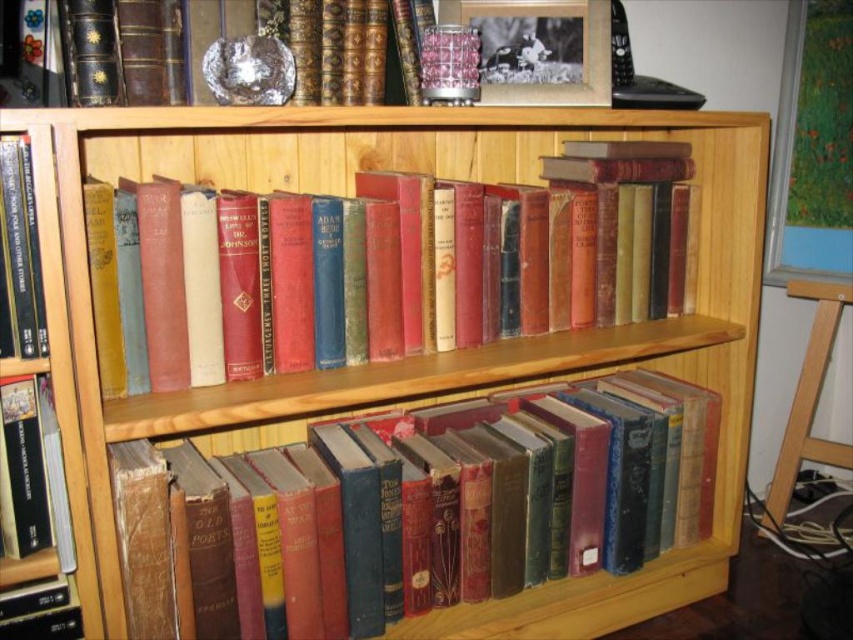
Measure the distance between point (660, 310) and camera.

A distance of 1.33 meters exists between point (660, 310) and camera.

Who is more distant from viewer, [538,269] or [12,225]?

Point [538,269]

This screenshot has height=640, width=853. What do you see at coordinates (460, 266) in the screenshot?
I see `matte hardcover books at center` at bounding box center [460, 266].

I want to click on matte hardcover books at center, so click(x=460, y=266).

Can you confirm if matte black book at left is positioned to the right of leather-bound book at upper left?

Incorrect, matte black book at left is not on the right side of leather-bound book at upper left.

Is matte black book at left taller than leather-bound book at upper left?

Indeed, matte black book at left has a greater height compared to leather-bound book at upper left.

You are a GUI agent. You are given a task and a screenshot of the screen. Output one action in this format:
    pyautogui.click(x=<x>, y=<y>)
    Task: Click on the matte black book at left
    
    Given the screenshot: What is the action you would take?
    tap(21, 248)

Where is `matte black book at left`? matte black book at left is located at coordinates (21, 248).

Does hardcover book at left come behind leather-bound book at upper left?

That is False.

Does hardcover book at left have a greater height compared to leather-bound book at upper left?

In fact, hardcover book at left may be shorter than leather-bound book at upper left.

Does point (0, 472) come farther from viewer compared to point (210, 20)?

No, it is in front of (210, 20).

What are the coordinates of `hardcover book at left` in the screenshot? It's located at (32, 472).